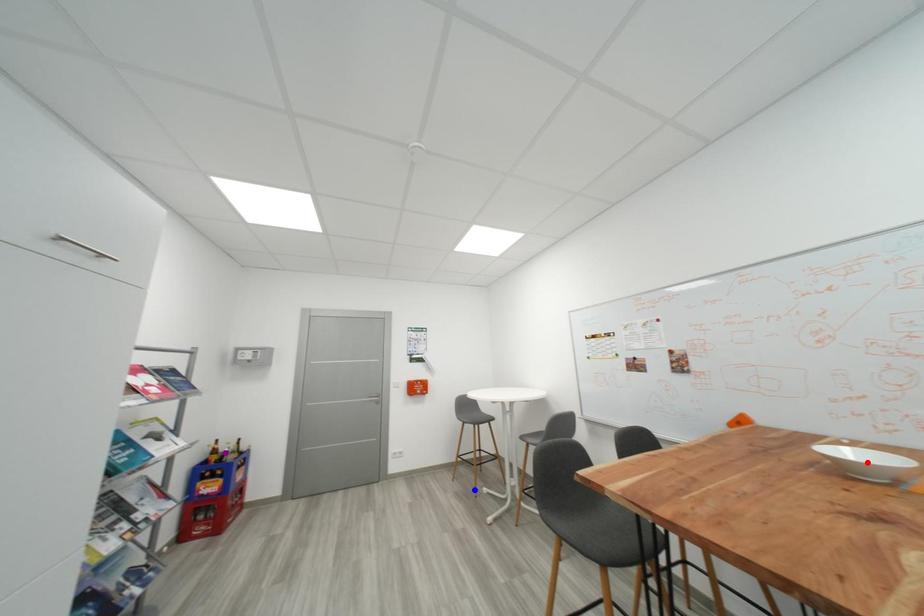
Order these from farthest to nearest:
purple point
red point
blue point

blue point < purple point < red point